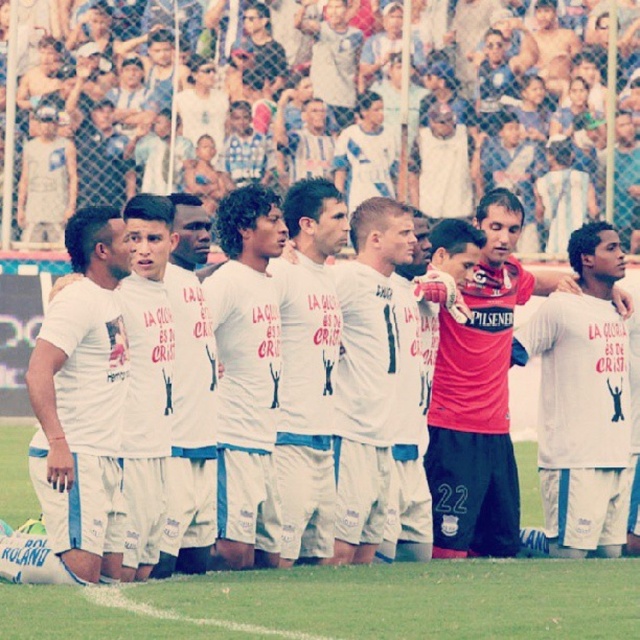
You are a photographer standing at the edge of the soccer field. You want to take a photo of the white fabric grass at center and the white cotton shirt at center so that both are in focus. The camera you are using has a depth of field that can cover 10 feet. Can you capture both objects in focus without moving the camera?

The white fabric grass at center and white cotton shirt at center are 12.27 feet apart from each other. Since the depth of field can only cover 10 feet, the distance between them exceeds the camera s capability. Therefore, you cannot capture both in focus without moving the camera.

What is the exact coordinate of the white fabric grass at center?

The white fabric grass at center is located at point (348, 604).